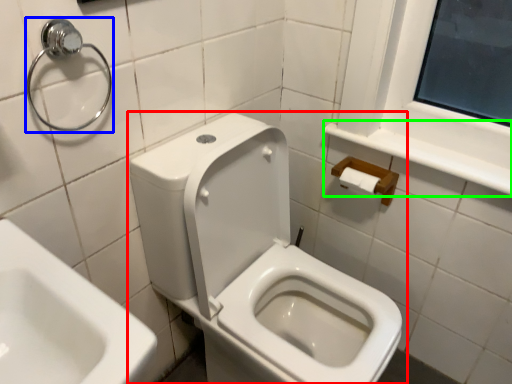
Question: Which is farther away from toilet (highlighted by a red box)? shower (highlighted by a blue box) or balustrade (highlighted by a green box)?

Choices:
 (A) shower
 (B) balustrade

Answer: (A)